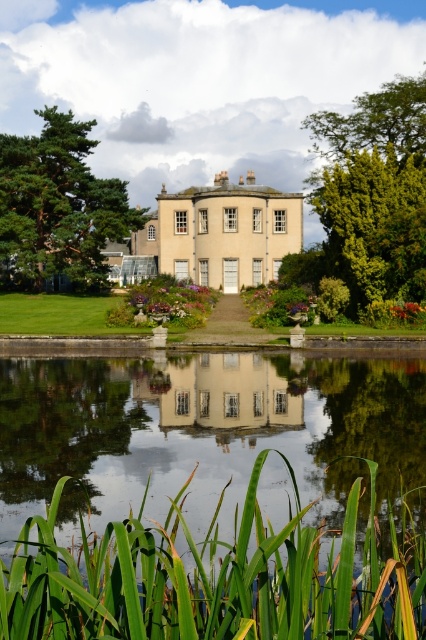
Is the position of transparent glass water at center less distant than that of green leafy grass at lower center?

No, it is behind green leafy grass at lower center.

Who is more forward, (135, 392) or (259, 572)?

Point (259, 572)

Is point (294, 362) behind point (408, 493)?

Yes, it is.

At what (x,y) coordinates should I click in order to perform the action: click on transparent glass water at center. Please return your answer as a coordinate pair (x, y). This screenshot has width=426, height=640. Looking at the image, I should click on (206, 429).

Is transparent glass water at center to the left of white glossy house at center from the viewer's perspective?

Indeed, transparent glass water at center is positioned on the left side of white glossy house at center.

Does transparent glass water at center come behind white glossy house at center?

No, it is in front of white glossy house at center.

Is point (317, 442) behind point (209, 428)?

No, it is not.

Find the location of a particular element. This screenshot has height=640, width=426. transparent glass water at center is located at coordinates (206, 429).

Which is more to the left, green leafy grass at lower center or white glossy house at center?

Positioned to the left is green leafy grass at lower center.

At what (x,y) coordinates should I click in order to perform the action: click on green leafy grass at lower center. Please return your answer as a coordinate pair (x, y). This screenshot has height=640, width=426. Looking at the image, I should click on (218, 577).

Does point (305, 568) come closer to viewer compared to point (221, 364)?

Yes.

Locate an element on the screen. green leafy grass at lower center is located at coordinates (218, 577).